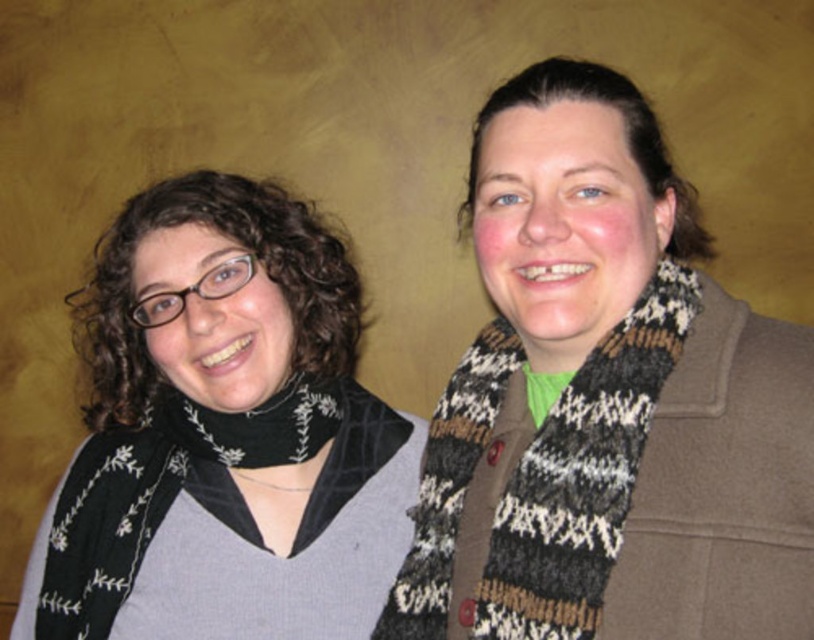
You are an observer looking at the two people in the scene. Which of the two knitted scarves, the knitted scarf at center or the black knitted scarf at left, is positioned higher?

The knitted scarf at center is positioned higher than the black knitted scarf at left.